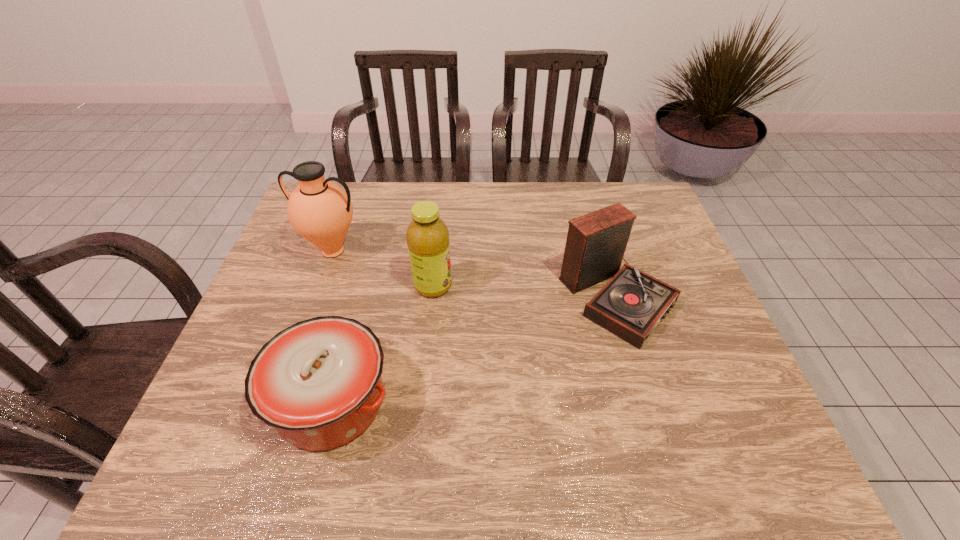
You are a GUI agent. You are given a task and a screenshot of the screen. Output one action in this format:
    pyautogui.click(x=<x>, y=<y>)
    Task: Click on the vacant space at the far right corner
    The height and width of the screenshot is (540, 960).
    Given the screenshot: What is the action you would take?
    pyautogui.click(x=616, y=190)

Find the location of a particular element. The height and width of the screenshot is (540, 960). vacant position at the near right corner of the desktop is located at coordinates (736, 474).

At what (x,y) coordinates should I click in order to perform the action: click on free space between the second object from right to left and the shortest object. Please return your answer as a coordinate pair (x, y). The image size is (960, 540). Looking at the image, I should click on (382, 344).

In order to click on free space between the third object from left to right and the rightmost object in this screenshot , I will do `click(525, 292)`.

Image resolution: width=960 pixels, height=540 pixels. In order to click on vacant region between the third object from left to right and the nearest object in this screenshot , I will do `click(382, 344)`.

This screenshot has width=960, height=540. I want to click on unoccupied position between the second object from right to left and the casserole, so click(382, 344).

This screenshot has height=540, width=960. Identify the location of free space between the shortest object and the phonograph record. (474, 349).

Locate an element on the screen. The width and height of the screenshot is (960, 540). blank region between the third object from left to right and the rightmost object is located at coordinates (525, 292).

At what (x,y) coordinates should I click in order to perform the action: click on vacant point located between the third object from left to right and the pitcher. Please return your answer as a coordinate pair (x, y). This screenshot has width=960, height=540. Looking at the image, I should click on (383, 268).

Where is `free area in between the rightmost object and the pitcher`? This screenshot has height=540, width=960. free area in between the rightmost object and the pitcher is located at coordinates (475, 274).